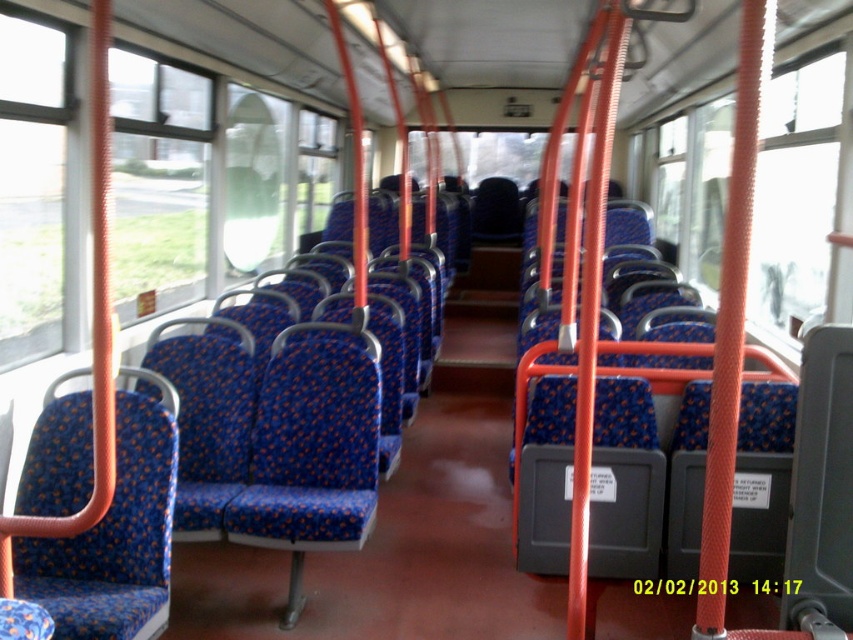
You are a passenger on a bus and want to know which window is taller between the transparent glass window at center and the transparent glass window at upper left. Can you tell me?

The transparent glass window at center has a greater height compared to the transparent glass window at upper left, so the transparent glass window at center is taller.

You are a passenger on a bus and want to look outside. You notice two windows, the transparent glass window at center and the transparent glass window at upper left. Which window is positioned to the right side of the other?

The transparent glass window at center is positioned to the right of the transparent glass window at upper left.

You are a passenger on a bus and need to check if your luggage can fit between the transparent glass window at upper left and the camera. The luggage is 3 meters long. Can it fit?

The distance between the transparent glass window at upper left and the camera is 3.48 meters. Since the luggage is 3 meters long, it can fit between them.